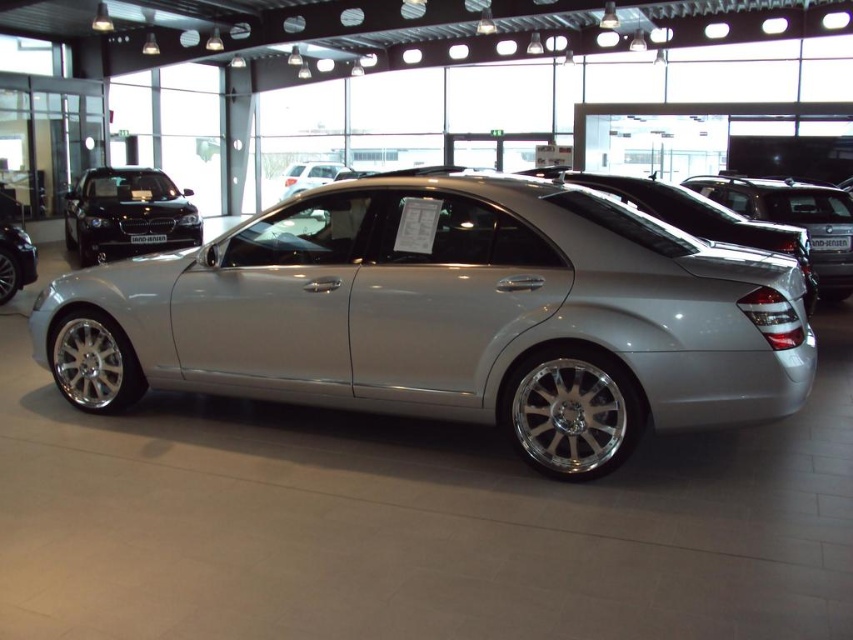
Question: Estimate the real-world distances between objects in this image. Which object is closer to the satin silver car at right?

Choices:
 (A) silver metallic car at center
 (B) satin silver car at center

Answer: (B)

Question: Does satin silver car at right have a larger size compared to satin silver car at center?

Choices:
 (A) no
 (B) yes

Answer: (B)

Question: Does satin silver car at center appear on the left side of silver metallic car at left?

Choices:
 (A) yes
 (B) no

Answer: (B)

Question: Which is farther from the shiny black car at left?

Choices:
 (A) silver metallic car at center
 (B) satin silver car at right
 (C) silver metallic car at left
 (D) satin silver car at center

Answer: (B)

Question: Is silver metallic car at center positioned behind shiny black car at left?

Choices:
 (A) yes
 (B) no

Answer: (B)

Question: Which point appears closest to the camera in this image?

Choices:
 (A) (572, 467)
 (B) (683, 205)
 (C) (67, 244)
 (D) (27, 272)

Answer: (A)